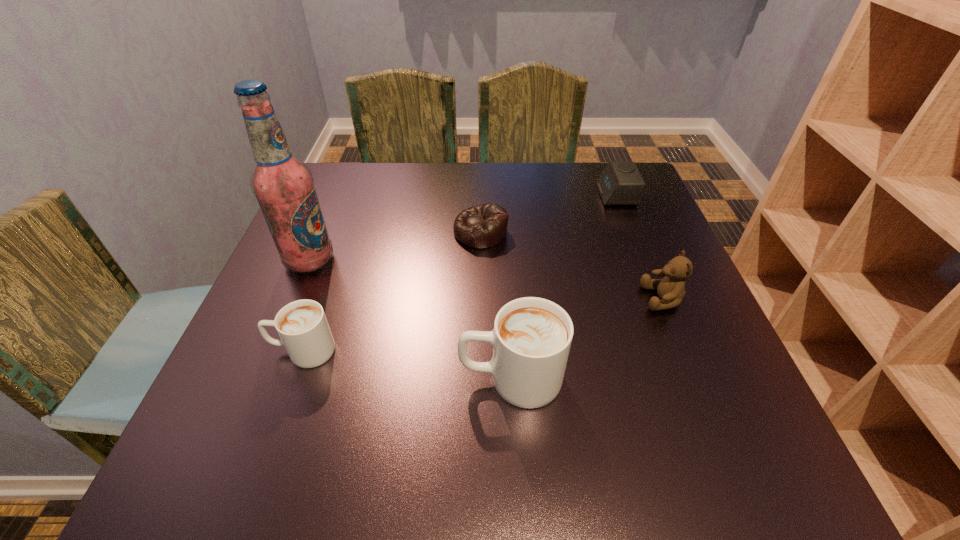
Locate an element on the screen. Image resolution: width=960 pixels, height=540 pixels. the fourth tallest object is located at coordinates (302, 326).

At what (x,y) coordinates should I click in order to perform the action: click on the left cappuccino. Please return your answer as a coordinate pair (x, y). Looking at the image, I should click on (302, 326).

The height and width of the screenshot is (540, 960). What are the coordinates of `the second tallest object` in the screenshot? It's located at (532, 336).

I want to click on the right cappuccino, so click(532, 336).

What are the coordinates of `the second shortest object` in the screenshot? It's located at (620, 183).

This screenshot has width=960, height=540. What are the coordinates of `the farthest object` in the screenshot? It's located at (620, 183).

Identify the location of the tallest object. (284, 187).

Find the location of a particular element. This screenshot has width=960, height=540. the shortest object is located at coordinates (482, 226).

Identify the location of the third tallest object. The width and height of the screenshot is (960, 540). (671, 289).

Find the location of `the third nearest object`. the third nearest object is located at coordinates (671, 289).